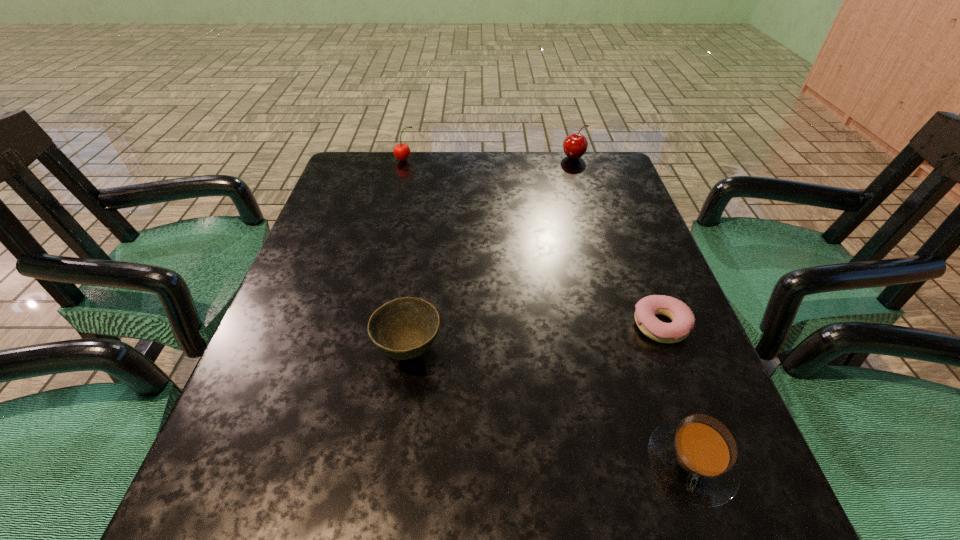
The height and width of the screenshot is (540, 960). I want to click on the left cherry, so click(x=401, y=151).

Find the location of a particular element. The height and width of the screenshot is (540, 960). the right cherry is located at coordinates (575, 145).

Image resolution: width=960 pixels, height=540 pixels. Identify the location of bowl. (404, 328).

What are the coordinates of `the second shortest object` in the screenshot? It's located at (695, 458).

Where is `the nearest object`? Image resolution: width=960 pixels, height=540 pixels. the nearest object is located at coordinates 695,458.

The width and height of the screenshot is (960, 540). What are the coordinates of `the shortest object` in the screenshot? It's located at (x=683, y=321).

Locate an element on the screen. The image size is (960, 540). vacant space located on the front of the left cherry is located at coordinates (400, 179).

At what (x,y) coordinates should I click in order to perform the action: click on free location located on the left of the right cherry. Please return your answer as a coordinate pair (x, y). Looking at the image, I should click on (501, 157).

The image size is (960, 540). Identify the location of blank space located on the left of the bowl. pos(337,350).

Where is `vacant area located on the left of the nearest object`? vacant area located on the left of the nearest object is located at coordinates (574, 464).